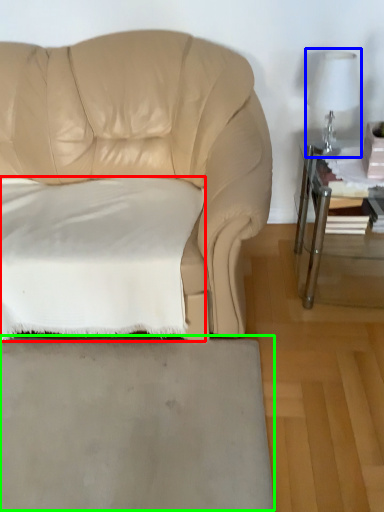
Question: Which object is positioned farthest from pillow (highlighted by a red box)? Select from table lamp (highlighted by a blue box) and concrete (highlighted by a green box).

Choices:
 (A) table lamp
 (B) concrete

Answer: (A)